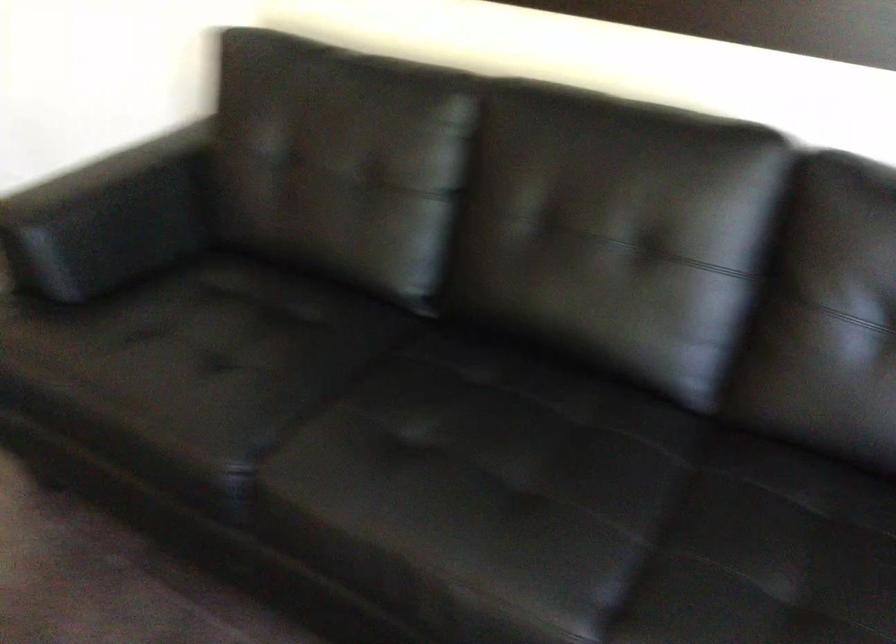
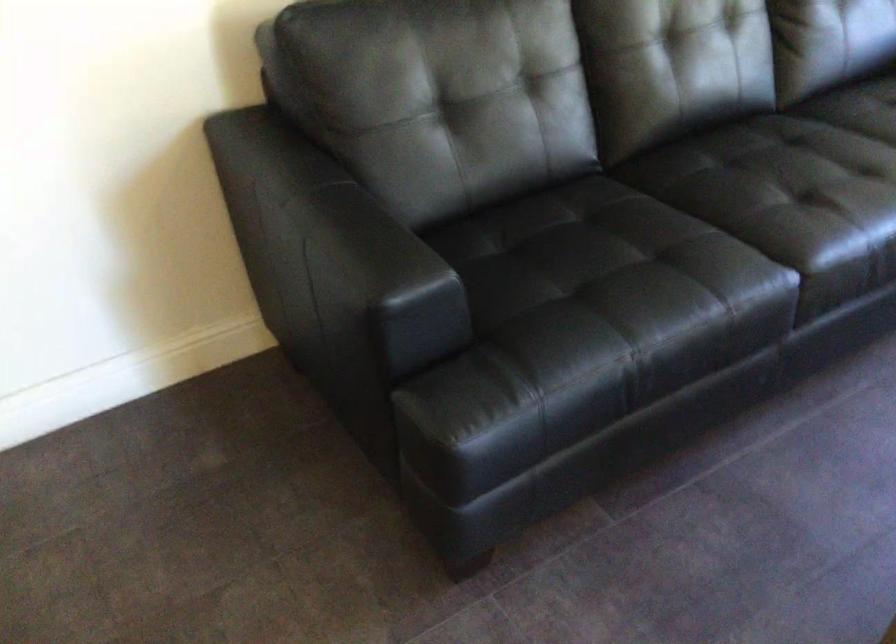
The point at (421, 440) is marked in the first image. Where is the corresponding point in the second image?

(788, 200)